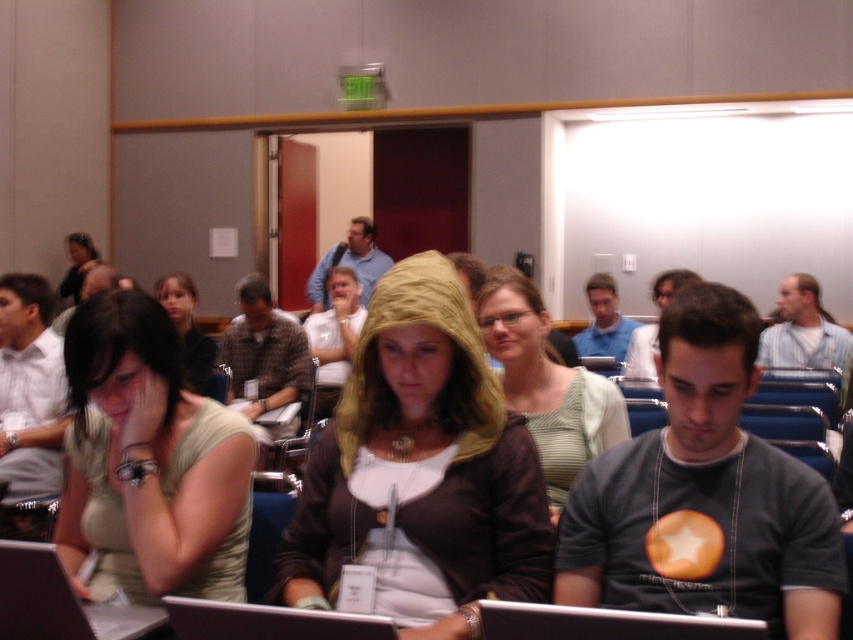
Question: Does matte gold hoodie at center appear over green matte shirt at center?

Choices:
 (A) yes
 (B) no

Answer: (A)

Question: Which object is farther from the camera taking this photo?

Choices:
 (A) matte gold hoodie at center
 (B) matte black hoodie at center
 (C) green matte shirt at center

Answer: (B)

Question: Which point is closer to the camera?

Choices:
 (A) (496, 326)
 (B) (73, 452)

Answer: (B)

Question: Which point appears closest to the camera in this image?

Choices:
 (A) (138, 396)
 (B) (593, 454)
 (C) (456, 284)

Answer: (C)

Question: Does green striped shirt at center have a smaller size compared to matte black hoodie at center?

Choices:
 (A) no
 (B) yes

Answer: (B)

Question: Is matte gold hoodie at center to the right of green matte shirt at center from the viewer's perspective?

Choices:
 (A) yes
 (B) no

Answer: (A)